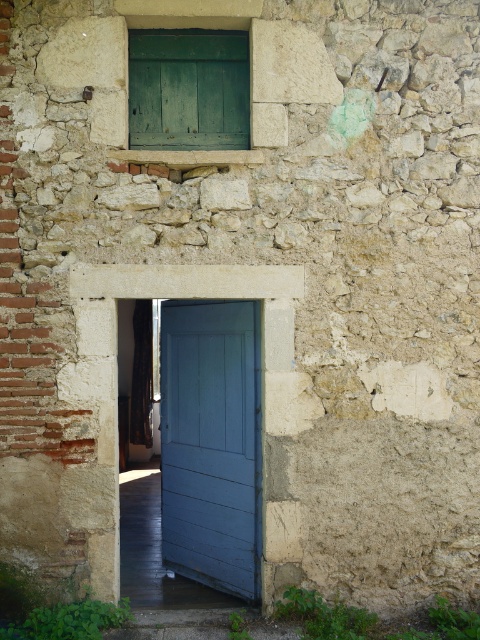
How distant is blue wooden door at center from green wooden window at upper center?

blue wooden door at center is 6.02 feet from green wooden window at upper center.

Is point (203, 570) behind point (245, 148)?

Yes, point (203, 570) is behind point (245, 148).

I want to click on blue wooden door at center, so click(x=211, y=442).

What are the coordinates of `blue wooden door at center` in the screenshot? It's located at (211, 442).